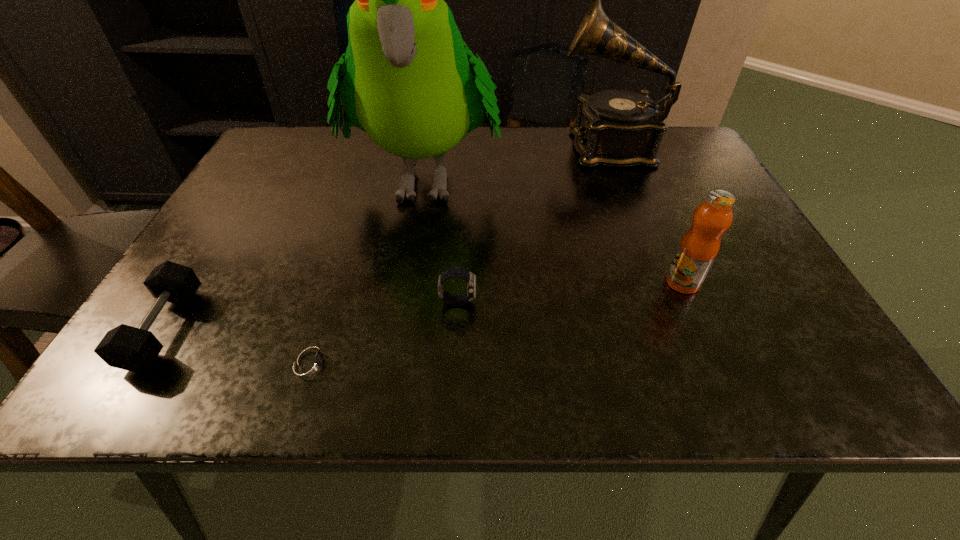
Find the location of a particular element. This screenshot has height=540, width=960. free location located on the horn of the phonograph record is located at coordinates (476, 146).

Locate an element on the screen. The image size is (960, 540). free space located 0.390m on the horn of the phonograph record is located at coordinates (414, 146).

Find the location of `blank area located on the back of the third tallest object`. blank area located on the back of the third tallest object is located at coordinates (650, 209).

Where is `vacant space situated on the face of the taller watch`? vacant space situated on the face of the taller watch is located at coordinates (573, 301).

Where is `vacant space located 0.150m on the back of the leftmost object`? This screenshot has width=960, height=540. vacant space located 0.150m on the back of the leftmost object is located at coordinates (222, 237).

At what (x,y) coordinates should I click in order to perform the action: click on vacant area situated 0.110m on the face of the shorter watch. Please return your answer as a coordinate pair (x, y). The image size is (960, 540). Looking at the image, I should click on (409, 362).

This screenshot has height=540, width=960. Find the location of `parakeet located in the far edge section of the desktop`. parakeet located in the far edge section of the desktop is located at coordinates (406, 80).

Locate an element on the screen. This screenshot has width=960, height=540. phonograph record located in the far edge section of the desktop is located at coordinates (617, 128).

Find the location of `dumbbell present at the near edge`. dumbbell present at the near edge is located at coordinates (125, 347).

You are a GUI agent. You are given a task and a screenshot of the screen. Output one action in this format:
    pyautogui.click(x=<x>, y=<y>)
    Task: Click on the watch present at the near edge
    The height and width of the screenshot is (540, 960).
    Given the screenshot: What is the action you would take?
    pyautogui.click(x=310, y=362)